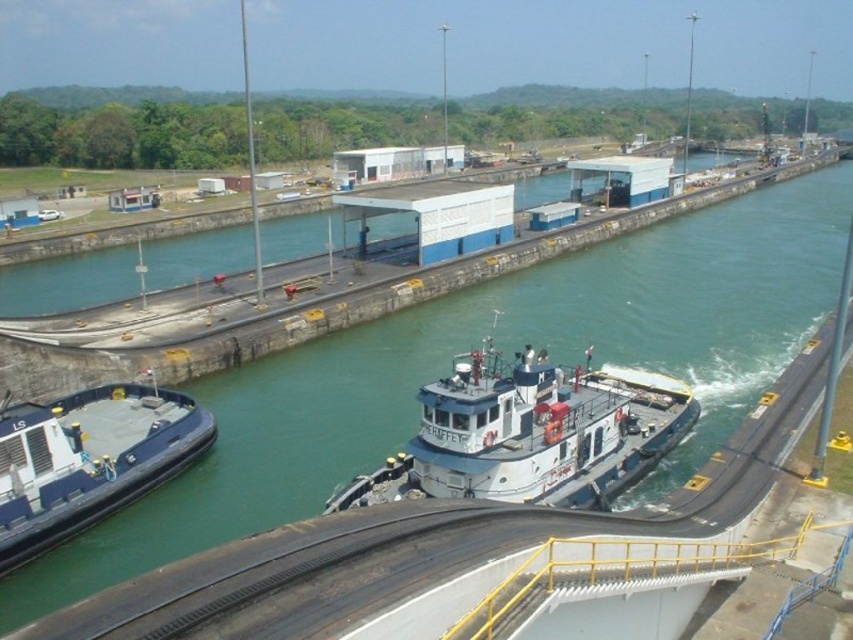
Can you confirm if white matte tugboat at center is positioned above blue rubber boat at left?

Correct, white matte tugboat at center is located above blue rubber boat at left.

Does point (637, 429) come closer to viewer compared to point (36, 433)?

No, (637, 429) is behind (36, 433).

Locate an element on the screen. The image size is (853, 640). white matte tugboat at center is located at coordinates (531, 433).